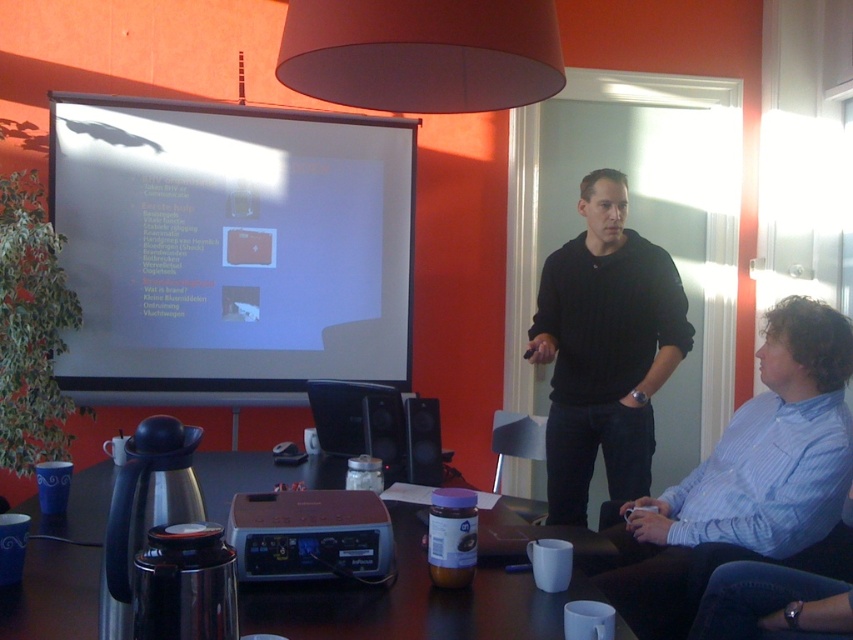
Question: Considering the real-world distances, which object is farthest from the dark wood table at center?

Choices:
 (A) blue striped shirt at lower right
 (B) white matte projection screen at upper left
 (C) black matte speaker at center

Answer: (B)

Question: Does white matte projection screen at upper left appear under black matte speaker at center?

Choices:
 (A) yes
 (B) no

Answer: (B)

Question: Which of the following is the closest to the observer?

Choices:
 (A) dark wood table at center
 (B) black cotton hoodie at center

Answer: (A)

Question: Where is white matte projection screen at upper left located in relation to dark wood table at center in the image?

Choices:
 (A) above
 (B) below

Answer: (A)

Question: Can you confirm if dark wood table at center is wider than black cotton hoodie at center?

Choices:
 (A) no
 (B) yes

Answer: (B)

Question: Based on their relative distances, which object is farther from the black cotton hoodie at center?

Choices:
 (A) black matte speaker at center
 (B) white matte projection screen at upper left
 (C) blue striped shirt at lower right

Answer: (B)